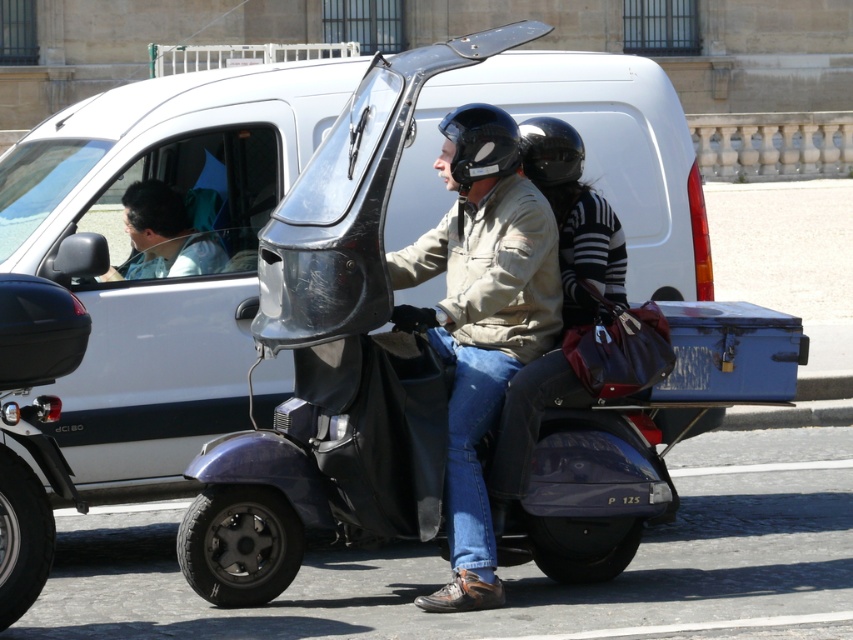
Who is higher up, matte khaki jacket at center or black glossy helmet at upper center?

Positioned higher is black glossy helmet at upper center.

Between matte khaki jacket at center and black glossy helmet at upper center, which one is positioned lower?

Positioned lower is matte khaki jacket at center.

The image size is (853, 640). Find the location of `matte khaki jacket at center`. matte khaki jacket at center is located at coordinates (480, 320).

Locate an element on the screen. matte khaki jacket at center is located at coordinates (480, 320).

Is light blue shirt at left positioned in front of black glossy helmet at upper center?

No, it is behind black glossy helmet at upper center.

Which is in front, point (154, 193) or point (520, 154)?

Point (520, 154) is in front.

Is point (173, 202) in front of point (550, 170)?

No.

This screenshot has height=640, width=853. In order to click on light blue shirt at left in this screenshot , I will do `click(163, 236)`.

Between matte khaki jacket at center and black matte helmet at center, which one appears on the right side from the viewer's perspective?

From the viewer's perspective, black matte helmet at center appears more on the right side.

Is point (482, 420) farther from viewer compared to point (515, 131)?

No.

Where is `matte khaki jacket at center`? The image size is (853, 640). matte khaki jacket at center is located at coordinates (480, 320).